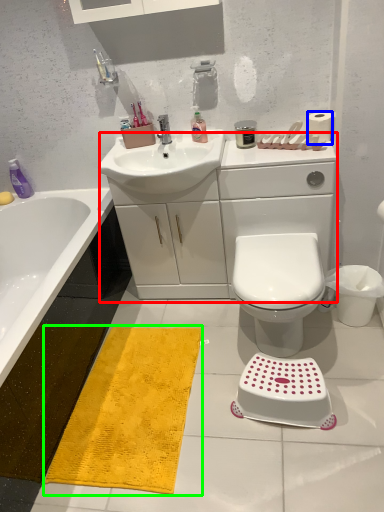
Question: Which object is positioned farthest from counter top (highlighted by a red box)? Select from toilet paper (highlighted by a blue box) and doormat (highlighted by a green box).

Choices:
 (A) toilet paper
 (B) doormat

Answer: (B)